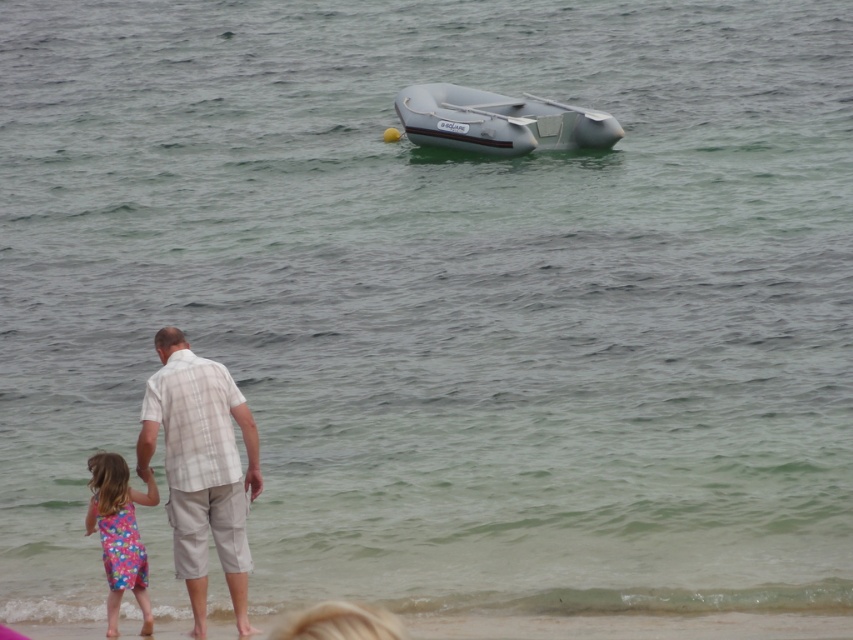
Is point (412, 132) positioned behind point (138, 560)?

Yes, point (412, 132) is farther from viewer.

Where is `silver rubber boat at upper center`? The image size is (853, 640). silver rubber boat at upper center is located at coordinates (498, 122).

Does white plaid shirt at center have a larger size compared to floral fabric dress at lower left?

Yes.

Between white plaid shirt at center and floral fabric dress at lower left, which one is positioned lower?

floral fabric dress at lower left

Between point (256, 465) and point (106, 480), which one is positioned behind?

Point (256, 465)

Where is `white plaid shirt at center`? white plaid shirt at center is located at coordinates (201, 468).

Is point (210, 442) farther from camera compared to point (495, 134)?

No, (210, 442) is in front of (495, 134).

Who is higher up, white plaid shirt at center or silver rubber boat at upper center?

silver rubber boat at upper center is higher up.

At what (x,y) coordinates should I click in order to perform the action: click on white plaid shirt at center. Please return your answer as a coordinate pair (x, y). This screenshot has height=640, width=853. Looking at the image, I should click on (201, 468).